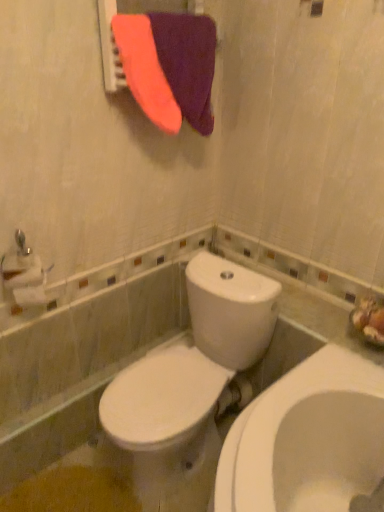
Locate an element on the screen. The width and height of the screenshot is (384, 512). purple fabric at upper center is located at coordinates (110, 48).

The height and width of the screenshot is (512, 384). Find the location of `white matte toilet paper at left`. white matte toilet paper at left is located at coordinates (26, 279).

In order to click on purple soft towel at upper center in this screenshot , I will do `click(169, 66)`.

Is white matte toilet paper at left looking in the opposite direction of purple fabric at upper center?

white matte toilet paper at left does not have its back to purple fabric at upper center.

From the image's perspective, which one is positioned higher, white matte toilet paper at left or purple fabric at upper center?

purple fabric at upper center appears higher in the image.

Is white matte toilet paper at left situated inside purple fabric at upper center or outside?

white matte toilet paper at left is not inside purple fabric at upper center, it's outside.

Looking at this image, from a real-world perspective, is white matte toilet paper at left on top of purple fabric at upper center?

Actually, white matte toilet paper at left is physically below purple fabric at upper center in the real world.

From a real-world perspective, is purple fabric at upper center positioned above or below white glossy toilet at center?

In terms of real-world spatial position, purple fabric at upper center is above white glossy toilet at center.

Measure the distance from purple fabric at upper center to white glossy toilet at center.

purple fabric at upper center and white glossy toilet at center are 38.26 inches apart.

Is purple fabric at upper center located outside white glossy toilet at center?

Absolutely, purple fabric at upper center is external to white glossy toilet at center.

Is purple fabric at upper center far from white glossy toilet at center?

purple fabric at upper center is actually quite close to white glossy toilet at center.

Do you think white matte toilet paper at left is within white glossy toilet at center, or outside of it?

The correct answer is: outside.

How many degrees apart are the facing directions of white matte toilet paper at left and white glossy toilet at center?

There is a 90-degree angle between the facing directions of white matte toilet paper at left and white glossy toilet at center.

Can you confirm if white matte toilet paper at left is wider than white glossy toilet at center?

In fact, white matte toilet paper at left might be narrower than white glossy toilet at center.

Which of these two, white matte toilet paper at left or white glossy toilet at center, stands taller?

white glossy toilet at center.

Based on their positions, is white matte toilet paper at left located to the left or right of purple soft towel at upper center?

white matte toilet paper at left is to the left of purple soft towel at upper center.

From the image's perspective, is white matte toilet paper at left located above purple soft towel at upper center?

No, from the image's perspective, white matte toilet paper at left is not on top of purple soft towel at upper center.

From a real-world perspective, between white matte toilet paper at left and purple soft towel at upper center, who is vertically higher?

purple soft towel at upper center, from a real-world perspective.

In the scene shown: What's the angular difference between white matte toilet paper at left and purple soft towel at upper center's facing directions?

The angle between the facing direction of white matte toilet paper at left and the facing direction of purple soft towel at upper center is 14.9 degrees.

Is purple fabric at upper center at the back of purple soft towel at upper center?

Yes, purple soft towel at upper center is facing away from purple fabric at upper center.

Between purple soft towel at upper center and purple fabric at upper center, which one has less height?

purple fabric at upper center.

Are purple soft towel at upper center and purple fabric at upper center far apart?

purple soft towel at upper center is actually quite close to purple fabric at upper center.

Which of these two, white glossy toilet at center or purple soft towel at upper center, stands shorter?

With less height is purple soft towel at upper center.

Who is bigger, white glossy toilet at center or purple soft towel at upper center?

white glossy toilet at center is bigger.

Would you say white glossy toilet at center is outside purple soft towel at upper center?

Absolutely, white glossy toilet at center is external to purple soft towel at upper center.

From the image's perspective, which one is positioned lower, white glossy toilet at center or purple soft towel at upper center?

white glossy toilet at center is shown below in the image.

Is the surface of purple soft towel at upper center in direct contact with white glossy toilet at center?

They are not placed beside each other.

Locate an element on the screen. This screenshot has width=384, height=512. toilet on the left of the purple soft towel at upper center is located at coordinates (193, 365).

Which of these two, purple soft towel at upper center or white glossy toilet at center, stands shorter?

purple soft towel at upper center is shorter.

Does point (196, 93) lie behind point (248, 392)?

That is False.

Locate an element on the screen. The width and height of the screenshot is (384, 512). toilet paper behind the purple fabric at upper center is located at coordinates (26, 279).

This screenshot has height=512, width=384. Find the location of `mirror that is above the white glossy toilet at center (from the image's perspective)`. mirror that is above the white glossy toilet at center (from the image's perspective) is located at coordinates (110, 48).

Which object lies further to the anchor point white glossy toilet at center, purple fabric at upper center or purple soft towel at upper center?

Based on the image, purple fabric at upper center appears to be further to white glossy toilet at center.

Estimate the real-world distances between objects in this image. Which object is further from purple soft towel at upper center, purple fabric at upper center or white glossy toilet at center?

white glossy toilet at center lies further to purple soft towel at upper center than the other object.

Which object lies further to the anchor point white matte toilet paper at left, purple fabric at upper center or white glossy toilet at center?

purple fabric at upper center.

Based on their spatial positions, is purple soft towel at upper center or white glossy toilet at center further from purple fabric at upper center?

The object further to purple fabric at upper center is white glossy toilet at center.

In the scene shown: Based on their spatial positions, is white glossy toilet at center or purple soft towel at upper center closer to white matte toilet paper at left?

Among the two, white glossy toilet at center is located nearer to white matte toilet paper at left.

Based on their spatial positions, is white glossy toilet at center or white matte toilet paper at left closer to purple fabric at upper center?

Among the two, white matte toilet paper at left is located nearer to purple fabric at upper center.

Looking at the image, which one is located closer to purple fabric at upper center, purple soft towel at upper center or white matte toilet paper at left?

purple soft towel at upper center lies closer to purple fabric at upper center than the other object.

Which object lies nearer to the anchor point white glossy toilet at center, purple soft towel at upper center or white matte toilet paper at left?

The object closer to white glossy toilet at center is white matte toilet paper at left.

You are a GUI agent. You are given a task and a screenshot of the screen. Output one action in this format:
    pyautogui.click(x=<x>, y=<y>)
    Task: Click on the beach towel between purple fabric at upper center and white matte toilet paper at left vertically
    
    Given the screenshot: What is the action you would take?
    pyautogui.click(x=169, y=66)

Where is `toilet paper that lies between purple fabric at upper center and white glossy toilet at center from top to bottom`? The height and width of the screenshot is (512, 384). toilet paper that lies between purple fabric at upper center and white glossy toilet at center from top to bottom is located at coordinates (26, 279).

Locate an element on the screen. The width and height of the screenshot is (384, 512). toilet paper between purple soft towel at upper center and white glossy toilet at center from top to bottom is located at coordinates (26, 279).

Image resolution: width=384 pixels, height=512 pixels. In order to click on beach towel between purple fabric at upper center and white glossy toilet at center from top to bottom in this screenshot , I will do `click(169, 66)`.